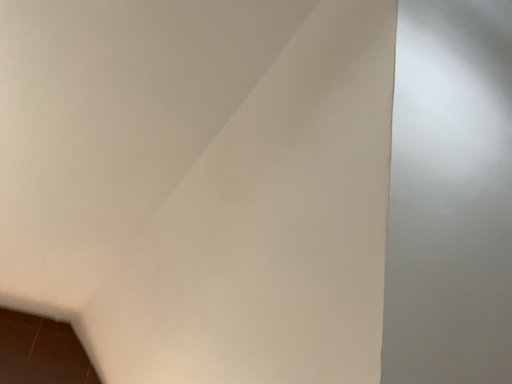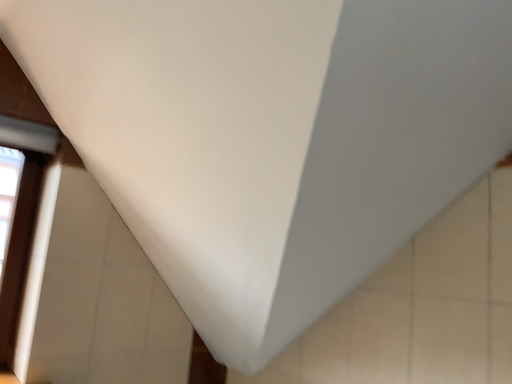
Question: Which way did the camera rotate in the video?

Choices:
 (A) rotated downward
 (B) rotated upward

Answer: (A)